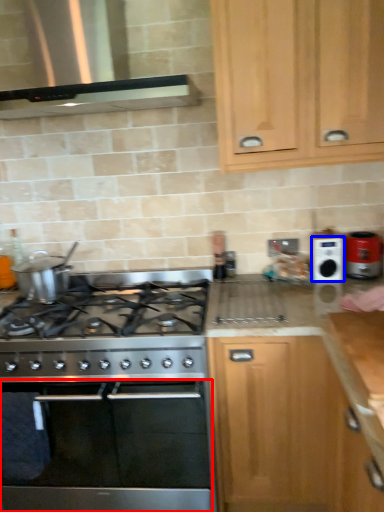
Question: Which of the following is the closest to the observer, oven (highlighted by a red box) or appliance (highlighted by a blue box)?

Choices:
 (A) oven
 (B) appliance

Answer: (A)